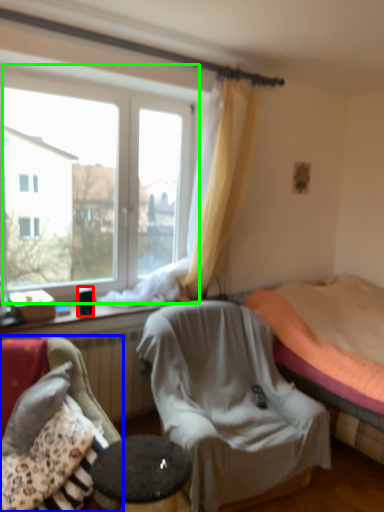
Question: Which is farther away from coffee cup (highlighted by a red box)? chair (highlighted by a blue box) or window (highlighted by a green box)?

Choices:
 (A) chair
 (B) window

Answer: (B)